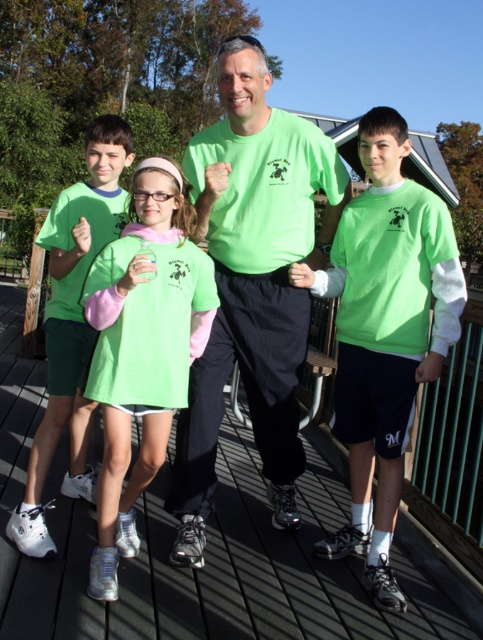
Question: Which point is farther from the camera taking this photo?

Choices:
 (A) (426, 339)
 (B) (86, 352)
 (C) (128, 308)

Answer: (B)

Question: Which of the following is the farthest from the observer?

Choices:
 (A) (283, 179)
 (B) (72, 445)
 (C) (380, 157)

Answer: (B)

Question: Is matte green t-shirt at center thinner than matte green shorts at center?

Choices:
 (A) no
 (B) yes

Answer: (A)

Question: Is matte green t-shirt at center bigger than matte green shorts at center?

Choices:
 (A) yes
 (B) no

Answer: (A)

Question: Which of the following is the closest to the observer?

Choices:
 (A) (238, 323)
 (B) (9, 524)
 (C) (190, 278)
 (D) (455, 262)

Answer: (C)

Question: Considering the relative positions of matte green t-shirt at center and matte green shorts at center in the image provided, where is matte green t-shirt at center located with respect to matte green shorts at center?

Choices:
 (A) above
 (B) below

Answer: (A)